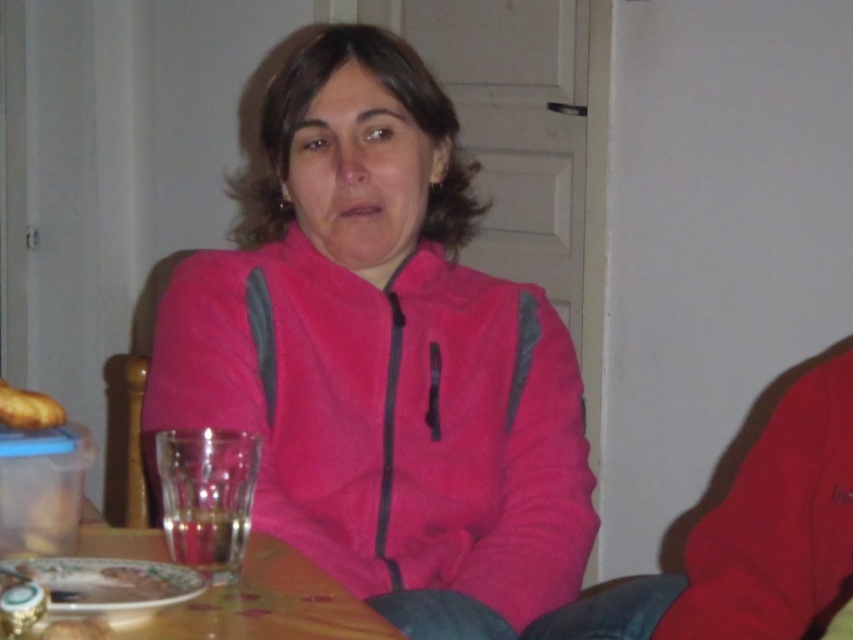
Locate an element on the screen. The height and width of the screenshot is (640, 853). pink fleece jacket at center is located at coordinates (384, 358).

Is pink fleece jacket at center smaller than golden brown bread at left?

No.

Is point (267, 490) in front of point (25, 416)?

No, it is behind (25, 416).

Image resolution: width=853 pixels, height=640 pixels. I want to click on pink fleece jacket at center, so click(384, 358).

What do you see at coordinates (268, 604) in the screenshot? I see `wooden table at lower center` at bounding box center [268, 604].

Does point (224, 608) lie behind point (24, 428)?

No, it is not.

Is point (196, 634) farther from camera compared to point (33, 392)?

No.

Where is `wooden table at lower center`? This screenshot has width=853, height=640. wooden table at lower center is located at coordinates (268, 604).

Which is below, pink fleece jacket at center or wooden table at lower center?

Positioned lower is wooden table at lower center.

Is point (393, 182) less distant than point (339, 634)?

No.

What are the coordinates of `pink fleece jacket at center` in the screenshot? It's located at (384, 358).